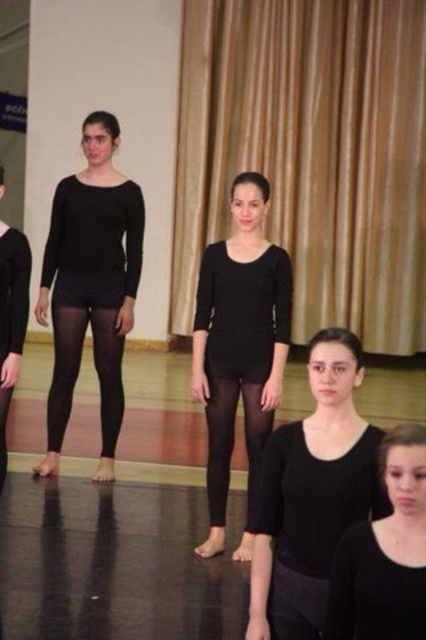
You are a stagehand preparing for a performance. You need to ensure that the gold fabric curtain at upper center is visible above the matte black leggings at center. Based on the scene description, will the curtain be visible above the leggings?

The gold fabric curtain at upper center is taller than matte black leggings at center, so yes, the curtain will be visible above the leggings.

You are a photographer setting up for a dance rehearsal. You need to place a spotlight on the left side of the matte black tights at left and another on the right side of the matte black leggings at center. Based on their positions, will the spotlights overlap?

The matte black tights at left is positioned on the left side of the matte black leggings at center, so placing a spotlight on the left side of the tights and another on the right side of the leggings would mean the spotlights are on opposite sides and would not overlap.